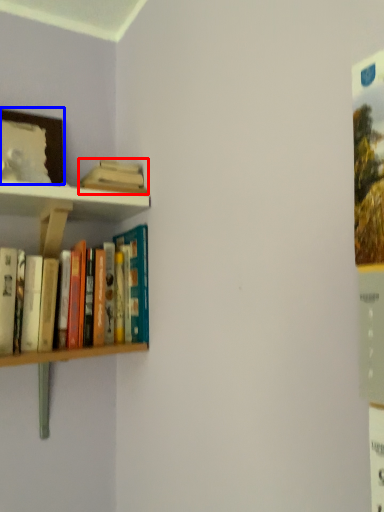
Question: Which object appears closest to the camera in this image, book (highlighted by a red box) or picture frame (highlighted by a blue box)?

Choices:
 (A) book
 (B) picture frame

Answer: (B)